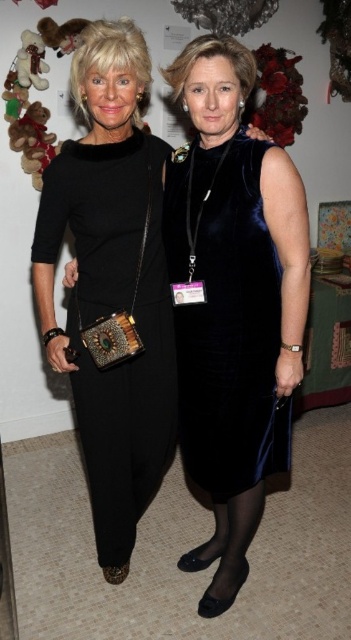
Question: Considering the relative positions of black velvet dress at left and velvet dark blue dress at center in the image provided, where is black velvet dress at left located with respect to velvet dark blue dress at center?

Choices:
 (A) above
 (B) below

Answer: (B)

Question: Can you confirm if black velvet dress at left is positioned below velvet dark blue dress at center?

Choices:
 (A) no
 (B) yes

Answer: (B)

Question: Among these points, which one is farthest from the camera?

Choices:
 (A) (256, 188)
 (B) (68, 314)

Answer: (B)

Question: Does black velvet dress at left appear on the left side of velvet dark blue dress at center?

Choices:
 (A) yes
 (B) no

Answer: (A)